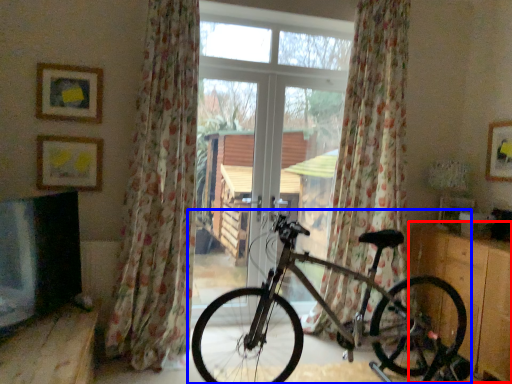
Question: Which point is closer to the camera, dresser (highlighted by a red box) or bicycle (highlighted by a blue box)?

Choices:
 (A) dresser
 (B) bicycle

Answer: (B)